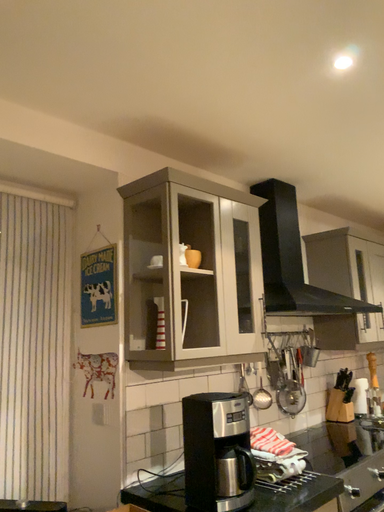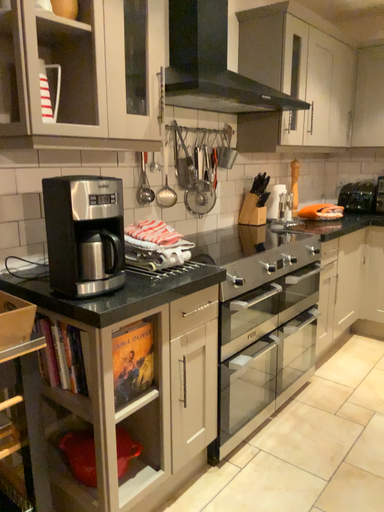
Question: Which way did the camera rotate in the video?

Choices:
 (A) rotated upward
 (B) rotated downward

Answer: (B)